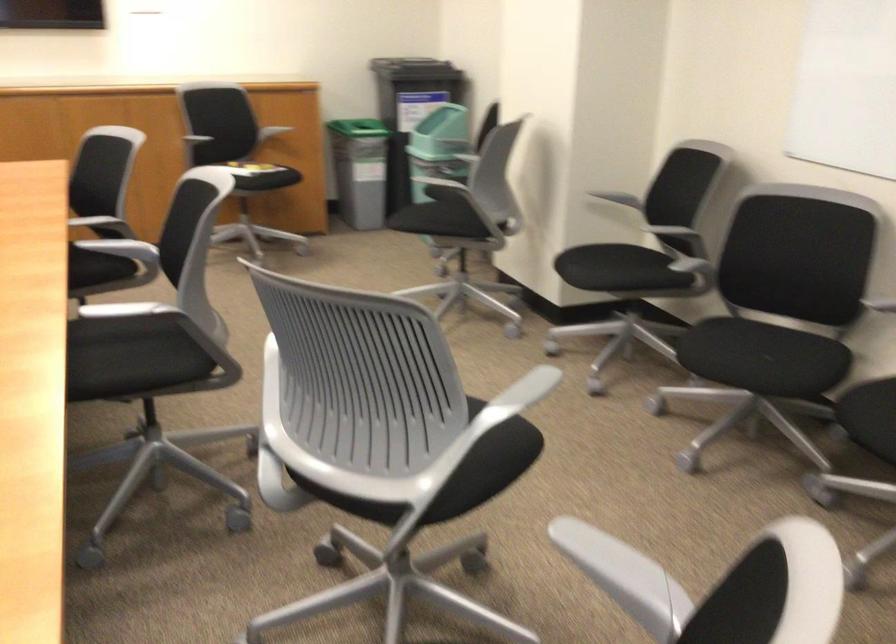
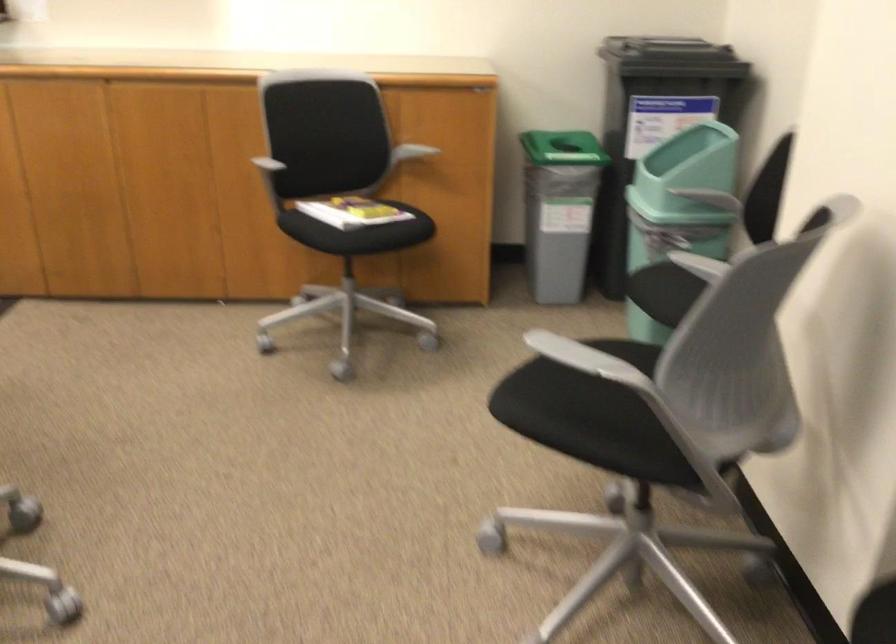
In the second image, find the point that corresponds to the point at 277,113 in the first image.

(409, 152)